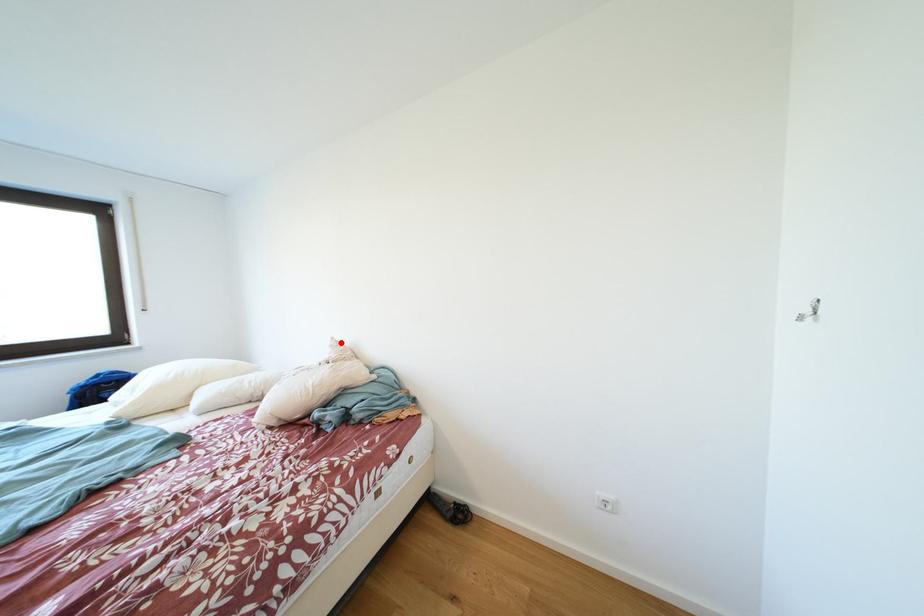
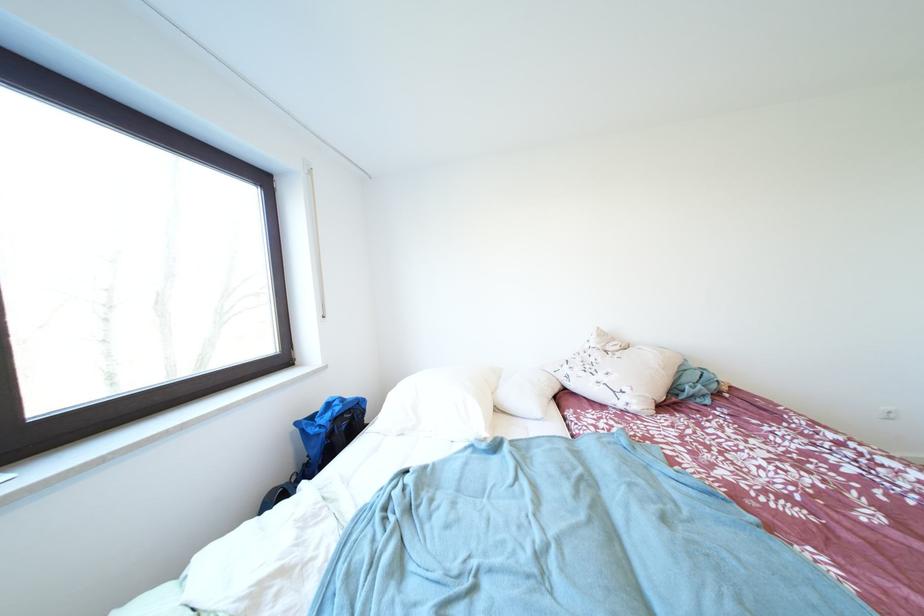
In the second image, find the point that corresponds to the highlighted location in the first image.

(606, 333)